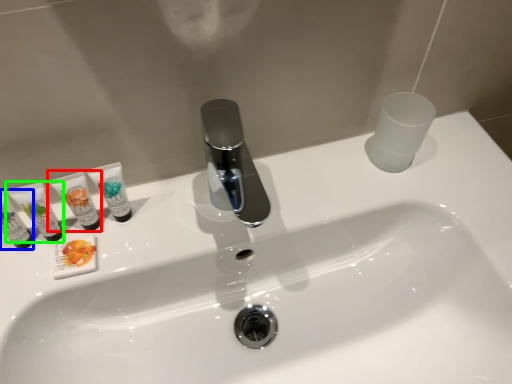
Question: Estimate the real-world distances between objects in this image. Which object is farther from toiletry (highlighted by a red box), toiletry (highlighted by a blue box) or toiletry (highlighted by a green box)?

Choices:
 (A) toiletry
 (B) toiletry

Answer: (A)